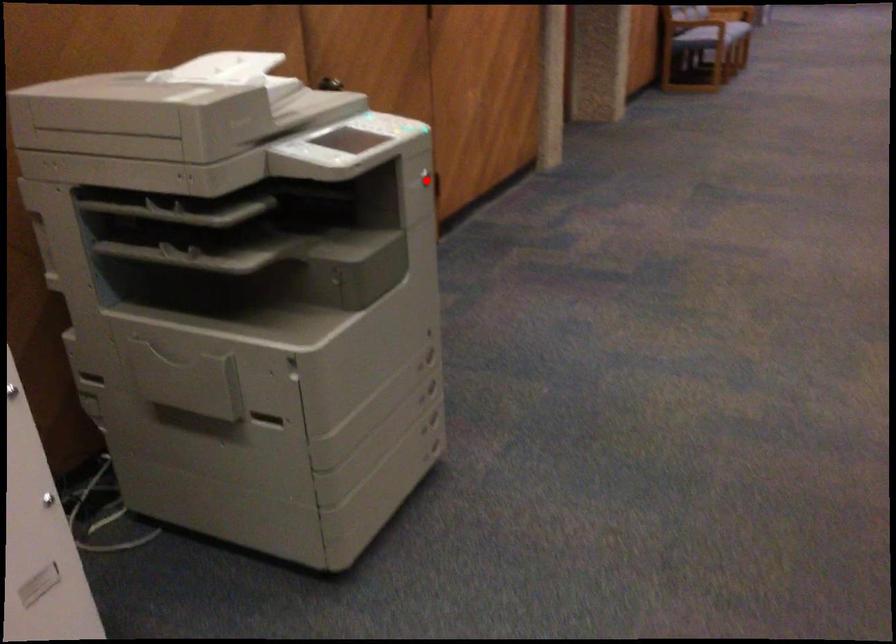
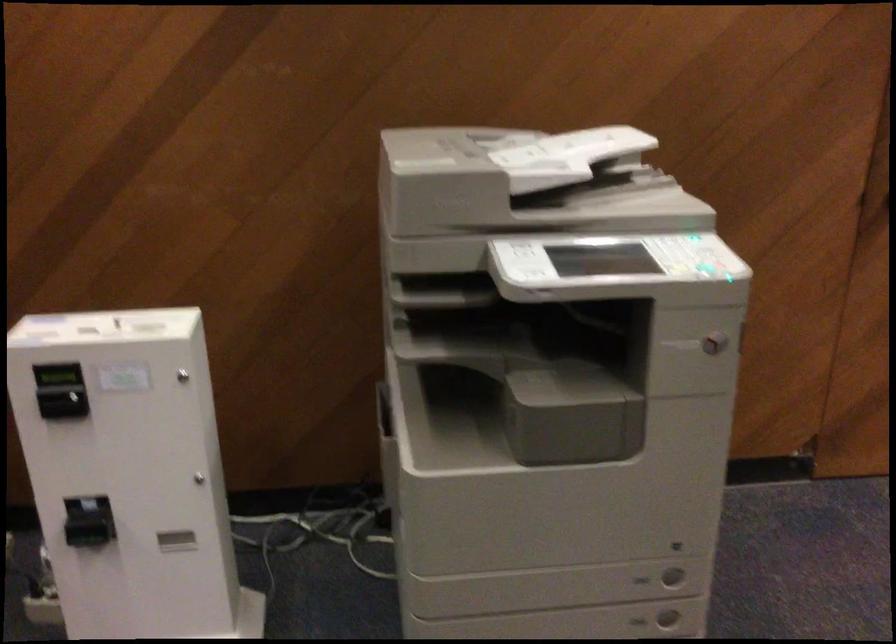
Question: A red point is marked in image1. In image2, is the corresponding 3D point closer to the camera or farther? Reply with the corresponding letter.

Choices:
 (A) The corresponding 3D point is closer.
 (B) The corresponding 3D point is farther.

Answer: (A)